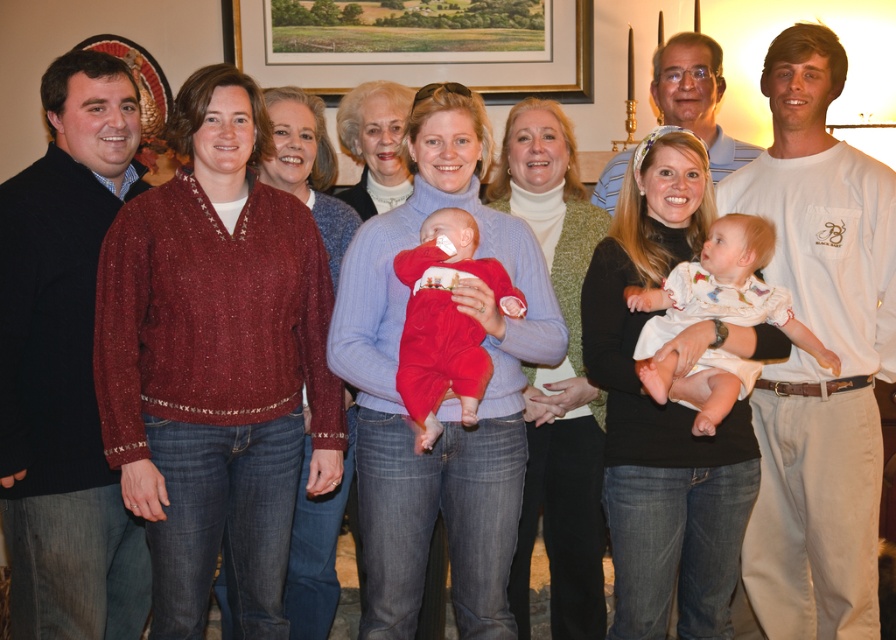
What is the color of the sweater at the point located at coordinates (448,396)?

The point at coordinates (448,396) is on a matte red sweater at center, so the color is red.

You are a photographer setting up for a family photo in this living room. You need to position a 2.5 meter long extension cord from the matte red sweater at center to the wooden picture frame at upper center. Will the cord be long enough to reach without bending it?

The distance between the matte red sweater at center and the wooden picture frame at upper center is 2.22 meters. Since the extension cord is 2.5 meters long, it will be long enough to reach without bending it.